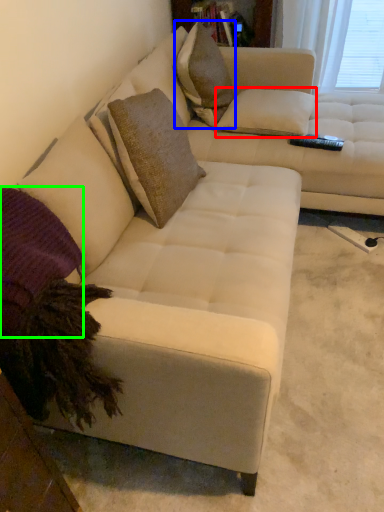
Question: Based on their relative distances, which object is nearer to pillow (highlighted by a red box)? Choose from throw pillow (highlighted by a blue box) and pillow (highlighted by a green box).

Choices:
 (A) throw pillow
 (B) pillow

Answer: (A)